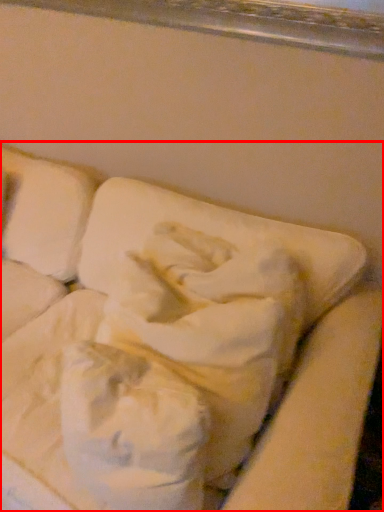
Question: From the image's perspective, considering the relative positions of furniture (annotated by the red box) and pillow in the image provided, where is furniture (annotated by the red box) located with respect to the staircase?

Choices:
 (A) above
 (B) below

Answer: (B)